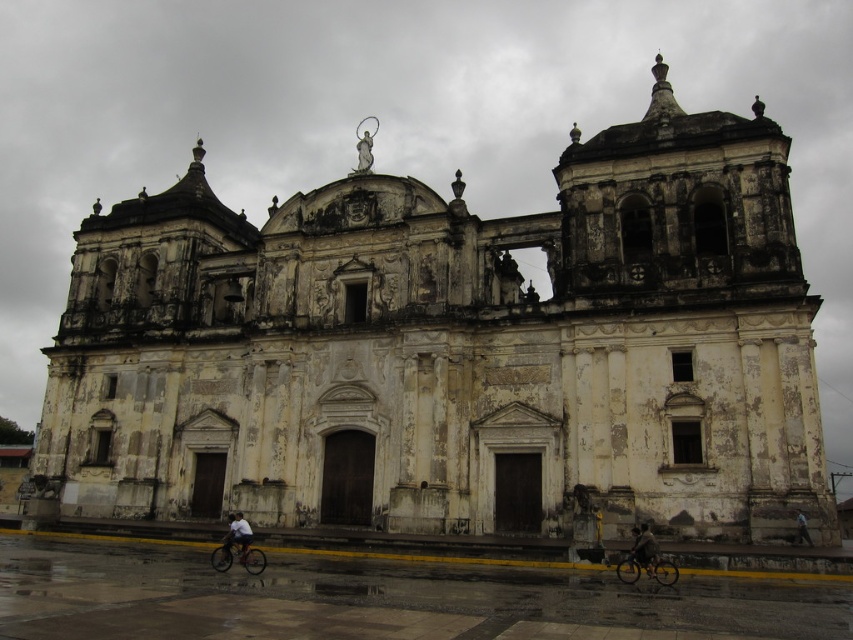
You are standing in front of the historic church and want to park your shiny metallic bicycle at lower right. Where should you place it?

Place the shiny metallic bicycle at lower right at point [646,570].